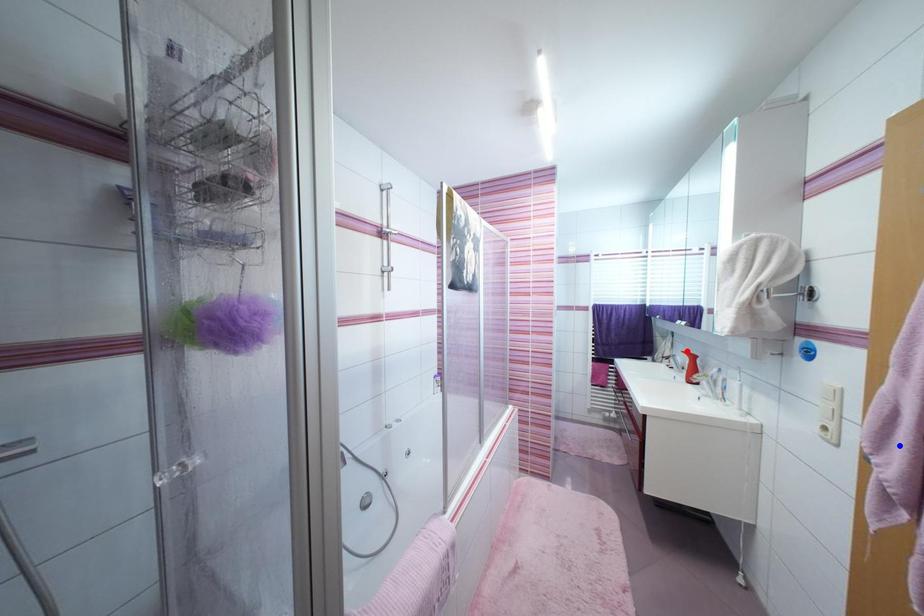
Question: In the image, two points are highlighted. Which point is nearer to the camera? Reply with the corresponding letter.

Choices:
 (A) blue point
 (B) red point

Answer: (A)